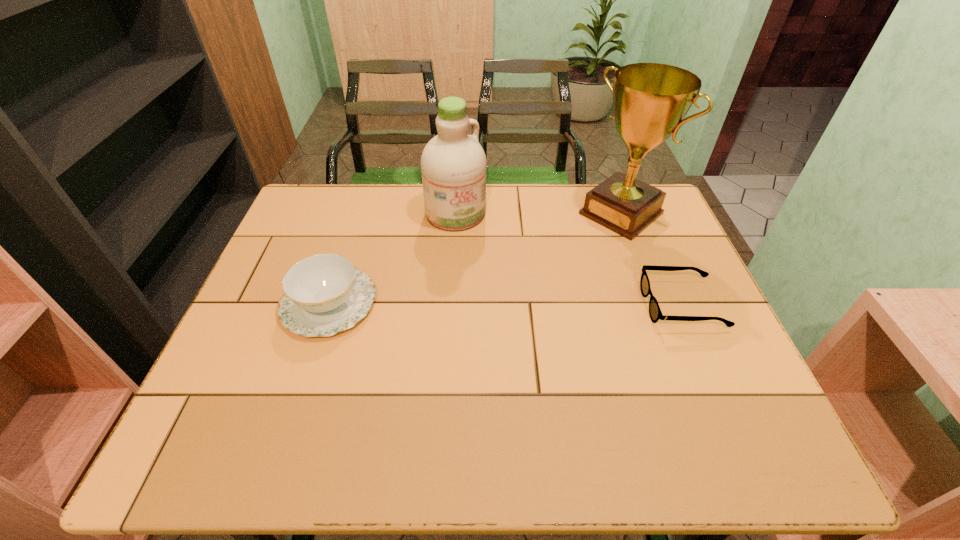
The height and width of the screenshot is (540, 960). I want to click on chinaware, so click(324, 294).

What are the coordinates of `the leftmost object` in the screenshot? It's located at (324, 294).

Identify the location of the shortest object. This screenshot has height=540, width=960. (655, 313).

Find the location of a particular element. Image resolution: width=960 pixels, height=540 pixels. the third shortest object is located at coordinates (453, 164).

Locate an element on the screen. cleansing agent is located at coordinates (453, 164).

In order to click on award in this screenshot , I will do `click(650, 100)`.

Where is `free space located on the handle side of the chinaware`? This screenshot has height=540, width=960. free space located on the handle side of the chinaware is located at coordinates (529, 304).

The image size is (960, 540). What are the coordinates of `blank area located 0.380m on the arms of the shortest object` in the screenshot? It's located at (492, 306).

The width and height of the screenshot is (960, 540). I want to click on vacant space located on the arms of the shortest object, so click(529, 306).

The height and width of the screenshot is (540, 960). What are the coordinates of `vacant space located 0.150m on the arms of the shortest object` in the screenshot? It's located at point(586,306).